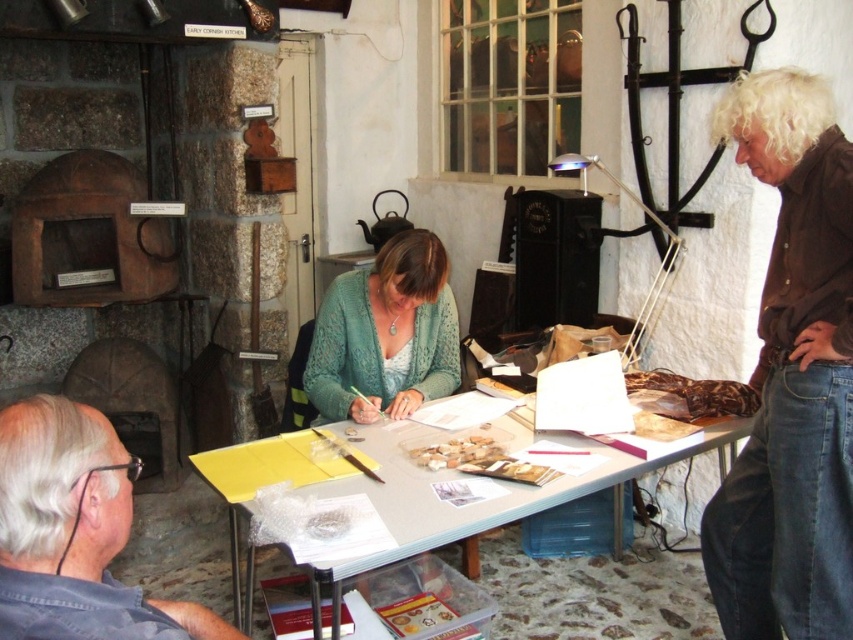
Question: Which object is positioned farthest from the gray fabric shirt at lower left?

Choices:
 (A) green knitted cardigan at center
 (B) brown cotton shirt at right
 (C) yellow plastic table at center

Answer: (B)

Question: Is gray fabric shirt at lower left positioned at the back of green knitted cardigan at center?

Choices:
 (A) yes
 (B) no

Answer: (B)

Question: Is gray fabric shirt at lower left positioned before green knitted cardigan at center?

Choices:
 (A) yes
 (B) no

Answer: (A)

Question: Does brown cotton shirt at right have a lesser width compared to green knitted cardigan at center?

Choices:
 (A) yes
 (B) no

Answer: (A)

Question: Which point appears farthest from the camera in this image?

Choices:
 (A) (375, 356)
 (B) (822, 77)

Answer: (A)

Question: Among these points, which one is nearest to the camera?

Choices:
 (A) (77, 616)
 (B) (766, 564)
 (C) (241, 604)

Answer: (A)